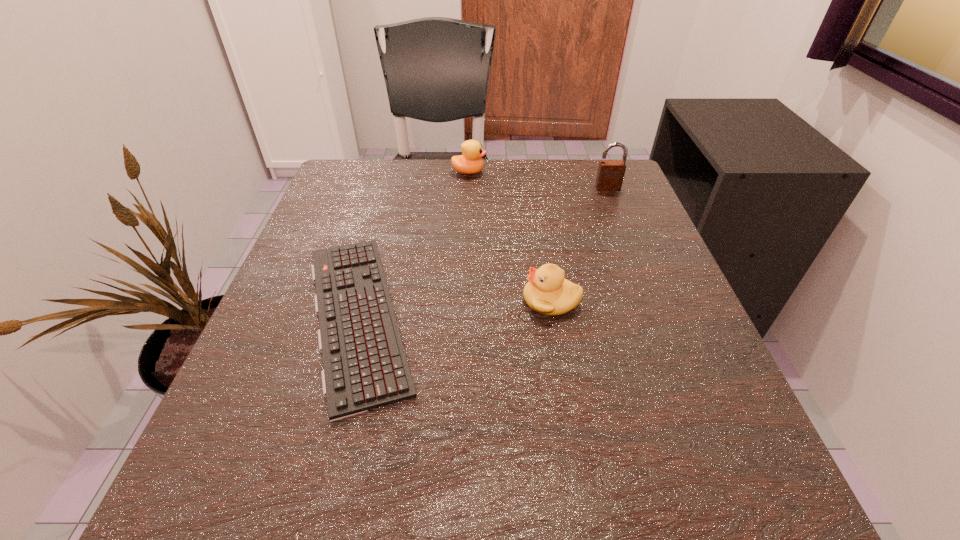
In order to click on free spot between the tallest object and the leftmost object in this screenshot , I will do `click(483, 252)`.

Identify the location of vacant area between the second object from left to right and the leftmost object. The image size is (960, 540). (413, 244).

This screenshot has width=960, height=540. Identify the location of vacant area between the right duckling and the farthest object. (510, 236).

The image size is (960, 540). Identify the location of free space between the nearer duckling and the shortest object. (454, 307).

I want to click on free space between the third nearest object and the leftmost object, so click(x=483, y=252).

Locate an element on the screen. object that is the closest to the tallest object is located at coordinates (470, 162).

I want to click on the closest object to the left duckling, so click(x=365, y=366).

Identify the location of vacant space that satisfies the following two spatial constraints: 1. on the front-facing side of the rightmost object; 2. at the face of the nearer duckling. This screenshot has height=540, width=960. (652, 300).

Where is `vacant area in the image that satisfies the following two spatial constraints: 1. on the front-facing side of the padlock; 2. at the face of the nearer duckling`? This screenshot has height=540, width=960. vacant area in the image that satisfies the following two spatial constraints: 1. on the front-facing side of the padlock; 2. at the face of the nearer duckling is located at coordinates (652, 300).